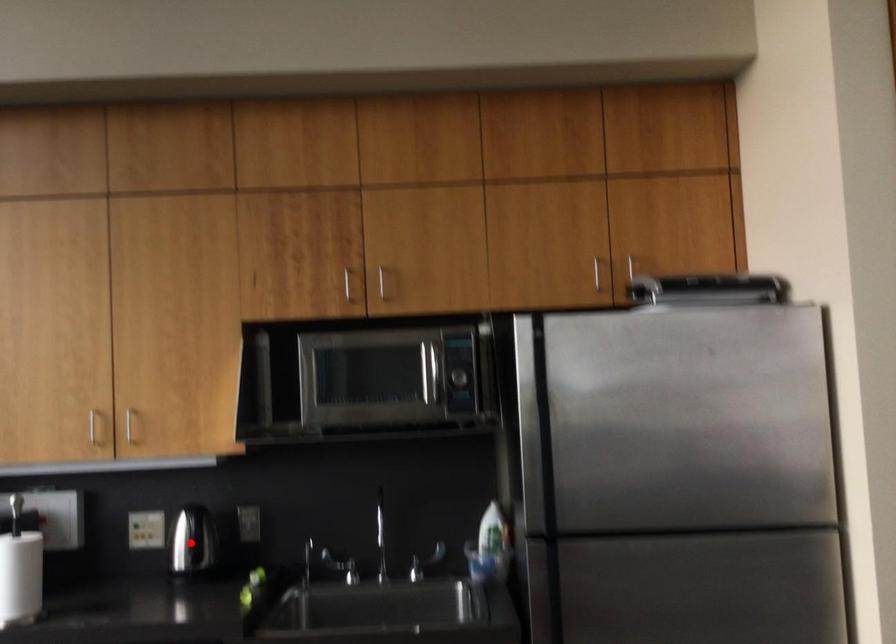
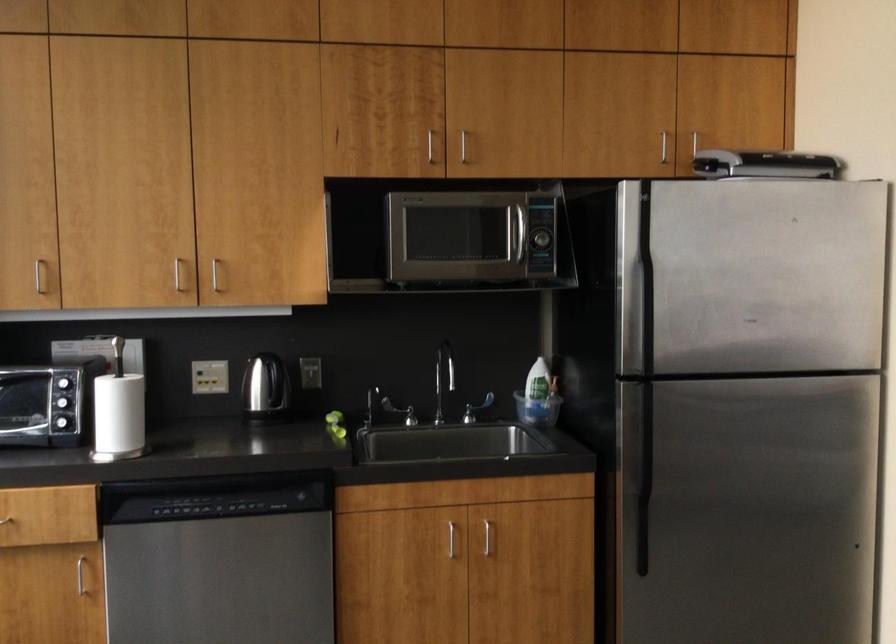
In the second image, find the point that corresponds to the highlighted location in the first image.

(266, 391)